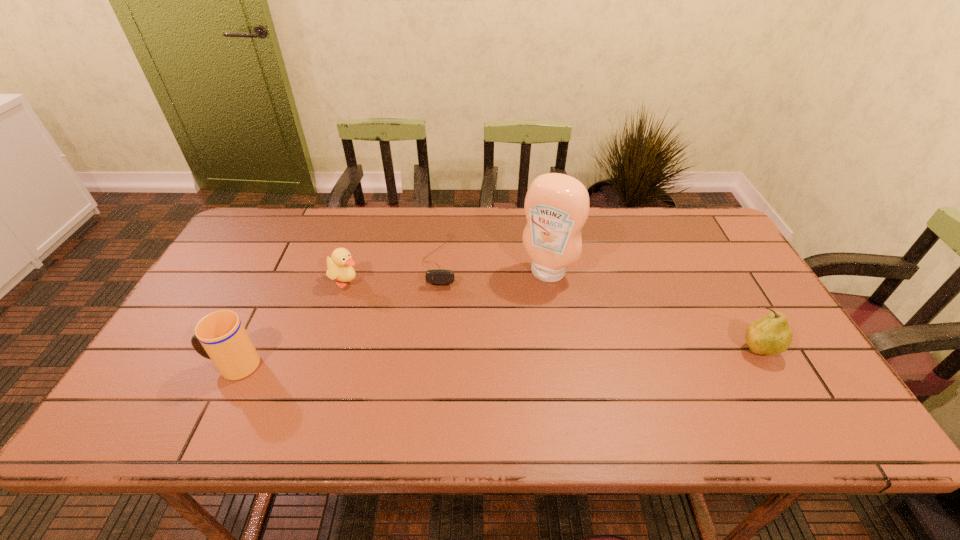
In order to click on object situated at the far edge in this screenshot , I will do coord(438,276).

Locate an element on the screen. object located at the near edge is located at coordinates (220, 336).

Where is `object at the left edge`? The height and width of the screenshot is (540, 960). object at the left edge is located at coordinates (220, 336).

Where is `object at the right edge`? object at the right edge is located at coordinates (771, 334).

This screenshot has width=960, height=540. Identify the location of object that is positioned at the near left corner. (220, 336).

This screenshot has height=540, width=960. In order to click on free space at the far edge of the desktop in this screenshot , I will do `click(482, 208)`.

Locate an element on the screen. This screenshot has width=960, height=540. free space at the near edge is located at coordinates (635, 385).

The width and height of the screenshot is (960, 540). In the image, there is a desktop. Find the location of `vacant space at the right edge`. vacant space at the right edge is located at coordinates (721, 260).

This screenshot has height=540, width=960. I want to click on vacant area between the shortest object and the duckling, so click(394, 271).

This screenshot has height=540, width=960. In order to click on unoccupied area between the webcam and the fourth object from right to left in this screenshot , I will do `click(394, 271)`.